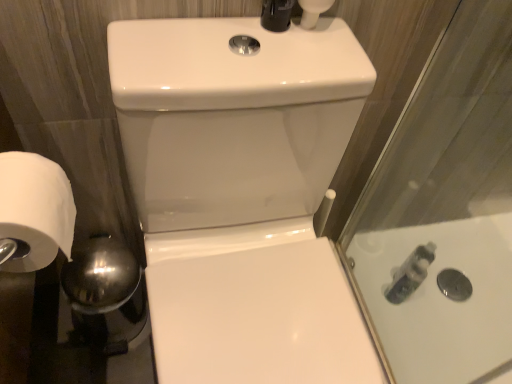
Question: From the image's perspective, is white matte toilet paper at left above or below translucent plastic bottle at right?

Choices:
 (A) below
 (B) above

Answer: (B)

Question: Is point (56, 170) positioned closer to the camera than point (428, 248)?

Choices:
 (A) closer
 (B) farther

Answer: (A)

Question: Considering the real-world distances, which object is closest to the white matte toilet paper at left?

Choices:
 (A) translucent plastic bottle at right
 (B) white glossy sink at center

Answer: (B)

Question: Based on their relative distances, which object is nearer to the white glossy sink at center?

Choices:
 (A) white matte toilet paper at left
 (B) translucent plastic bottle at right

Answer: (A)